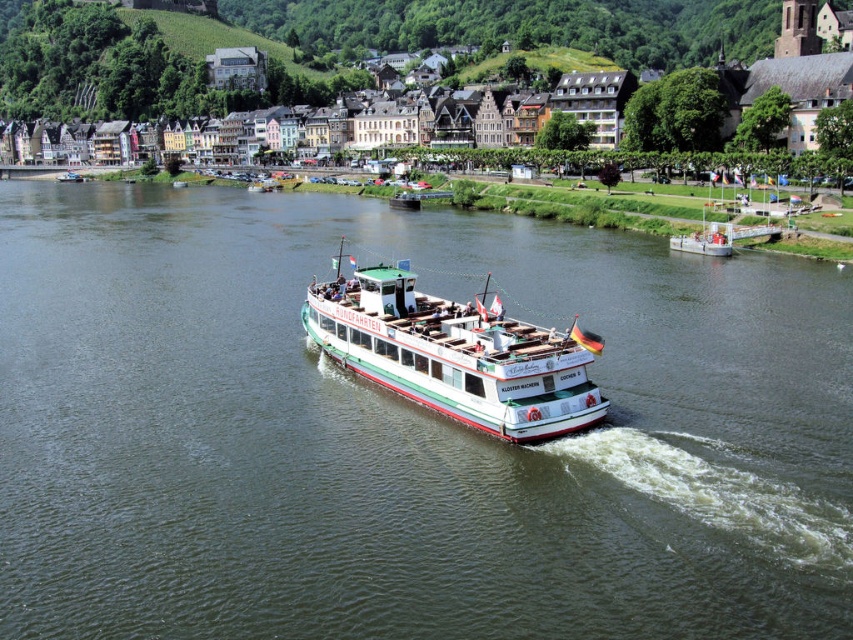
Which is in front, point (728, 291) or point (723, 230)?

Point (728, 291) is in front.

Measure the distance from green matte boat at center to white glossy boat at center.

71.33 feet

This screenshot has width=853, height=640. Describe the element at coordinates (404, 433) in the screenshot. I see `green matte boat at center` at that location.

Locate an element on the screen. This screenshot has width=853, height=640. green matte boat at center is located at coordinates (404, 433).

Is point (451, 256) less distant than point (567, 429)?

No.

Between point (183, 371) and point (390, 292), which one is positioned in front?

Point (390, 292) is in front.

Image resolution: width=853 pixels, height=640 pixels. What are the coordinates of `green matte boat at center` in the screenshot? It's located at (404, 433).

Is pastel painted buildings at center wider than white glossy boat at center?

Indeed, pastel painted buildings at center has a greater width compared to white glossy boat at center.

Does pastel painted buildings at center appear on the left side of white glossy boat at center?

Correct, you'll find pastel painted buildings at center to the left of white glossy boat at center.

Which is in front, point (730, 8) or point (708, 227)?

Positioned in front is point (708, 227).

The width and height of the screenshot is (853, 640). I want to click on pastel painted buildings at center, so click(519, 26).